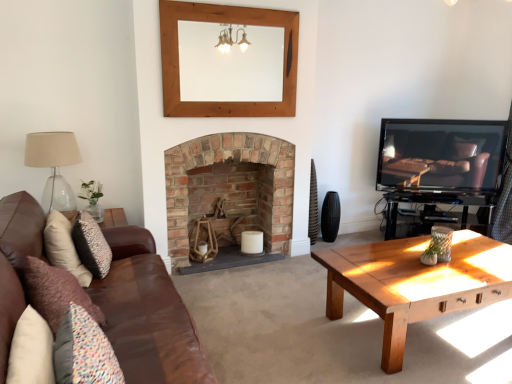
Question: Does velvet purple pillow at left, acting as the third pillow starting from the back, have a greater height compared to black matte speaker at center?

Choices:
 (A) yes
 (B) no

Answer: (A)

Question: Considering the relative positions of velvet purple pillow at left, acting as the third pillow starting from the back, and black matte speaker at center in the image provided, is velvet purple pillow at left, acting as the third pillow starting from the back, to the right of black matte speaker at center from the viewer's perspective?

Choices:
 (A) no
 (B) yes

Answer: (A)

Question: Considering the relative sizes of velvet purple pillow at left, which is the 1th pillow from front to back, and black matte speaker at center in the image provided, is velvet purple pillow at left, which is the 1th pillow from front to back, thinner than black matte speaker at center?

Choices:
 (A) yes
 (B) no

Answer: (A)

Question: Is the position of velvet purple pillow at left, which is the 1th pillow from front to back, less distant than that of black matte speaker at center?

Choices:
 (A) yes
 (B) no

Answer: (A)

Question: From the image's perspective, is velvet purple pillow at left, which ranks as the 2th pillow in left-to-right order, beneath black matte speaker at center?

Choices:
 (A) yes
 (B) no

Answer: (A)

Question: Is point (132, 284) closer or farther from the camera than point (496, 185)?

Choices:
 (A) closer
 (B) farther

Answer: (A)

Question: From a real-world perspective, is brown leather couch at center physically located above or below matte black tv at right?

Choices:
 (A) above
 (B) below

Answer: (B)

Question: Is brown leather couch at center bigger or smaller than matte black tv at right?

Choices:
 (A) small
 (B) big

Answer: (B)

Question: In terms of height, does brown leather couch at center look taller or shorter compared to matte black tv at right?

Choices:
 (A) tall
 (B) short

Answer: (A)

Question: Is matte black tv at right spatially inside multicolored fabric pillow at lower left, which is the third pillow from left to right, or outside of it?

Choices:
 (A) outside
 (B) inside

Answer: (A)

Question: Is point (431, 178) closer or farther from the camera than point (66, 382)?

Choices:
 (A) farther
 (B) closer

Answer: (A)

Question: Considering their positions, is matte black tv at right located in front of or behind multicolored fabric pillow at lower left, positioned as the 1th pillow in right-to-left order?

Choices:
 (A) front
 (B) behind

Answer: (B)

Question: In terms of height, does matte black tv at right look taller or shorter compared to multicolored fabric pillow at lower left, which is the 2th pillow from front to back?

Choices:
 (A) short
 (B) tall

Answer: (B)

Question: From the image's perspective, relative to matte black tv at right, is black matte speaker at center above or below?

Choices:
 (A) above
 (B) below

Answer: (B)

Question: From a real-world perspective, relative to matte black tv at right, is black matte speaker at center vertically above or below?

Choices:
 (A) above
 (B) below

Answer: (B)